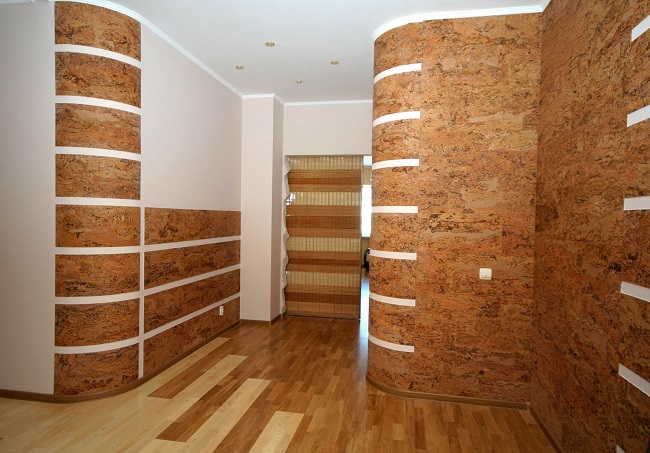
You are a GUI agent. You are given a task and a screenshot of the screen. Output one action in this format:
    pyautogui.click(x=<x>, y=<y>)
    Task: Click on the left wall
    This screenshot has width=650, height=453.
    Given the screenshot: What is the action you would take?
    pyautogui.click(x=216, y=161)